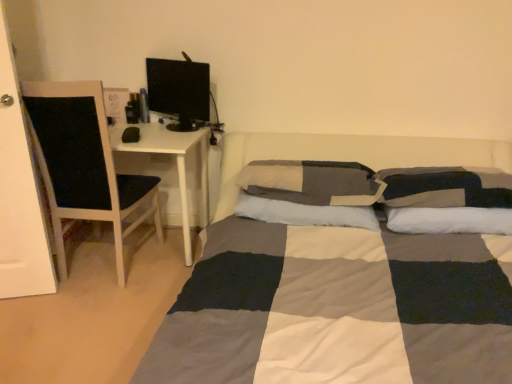
This screenshot has height=384, width=512. Identify the location of free region under white wood chair at left (from a real-world perspective). (131, 251).